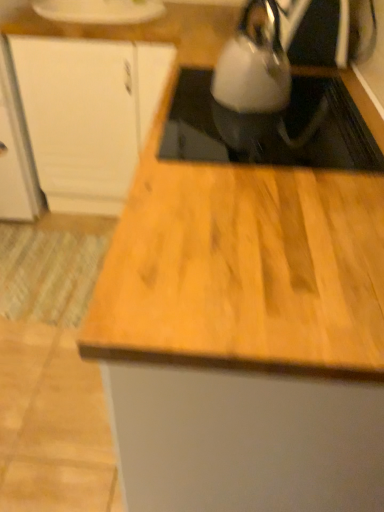
Describe the element at coordinates (88, 115) in the screenshot. The height and width of the screenshot is (512, 384). I see `white matte cabinet at upper left` at that location.

Where is `white matte cabinet at upper left`? The image size is (384, 512). white matte cabinet at upper left is located at coordinates (88, 115).

Identify the location of satin silver kettle at upper right. (253, 68).

Is satin silver kettle at upper right placed right next to white matte cabinet at upper left?

There is a gap between satin silver kettle at upper right and white matte cabinet at upper left.

Is satin silver kettle at upper right further to the viewer compared to white matte cabinet at upper left?

No.

Is white matte cabinet at upper left wider than white glossy kettle at upper center?

Yes, white matte cabinet at upper left is wider than white glossy kettle at upper center.

Consider the image. From the image's perspective, relative to white glossy kettle at upper center, is white matte cabinet at upper left above or below?

From the image's perspective, white matte cabinet at upper left appears above white glossy kettle at upper center.

From a real-world perspective, is white matte cabinet at upper left physically located above or below white glossy kettle at upper center?

white matte cabinet at upper left is situated lower than white glossy kettle at upper center in the real world.

Is white matte cabinet at upper left positioned with its back to white glossy kettle at upper center?

No.

Based on the photo, is white glossy kettle at upper center spatially inside white matte cabinet at upper left, or outside of it?

white glossy kettle at upper center cannot be found inside white matte cabinet at upper left.

Considering the sizes of white glossy kettle at upper center and white matte cabinet at upper left in the image, is white glossy kettle at upper center wider or thinner than white matte cabinet at upper left?

In the image, white glossy kettle at upper center appears to be more narrow than white matte cabinet at upper left.

How far apart are white glossy kettle at upper center and white matte cabinet at upper left?

33.94 inches.

Between white glossy kettle at upper center and white matte cabinet at upper left, which one has more height?

white matte cabinet at upper left is taller.

Can you confirm if satin silver kettle at upper right is shorter than white glossy kettle at upper center?

Incorrect, the height of satin silver kettle at upper right does not fall short of that of white glossy kettle at upper center.

Considering the sizes of objects satin silver kettle at upper right and white glossy kettle at upper center in the image provided, who is thinner, satin silver kettle at upper right or white glossy kettle at upper center?

Thinner between the two is satin silver kettle at upper right.

Where is `sink that is in front of the satin silver kettle at upper right`? The height and width of the screenshot is (512, 384). sink that is in front of the satin silver kettle at upper right is located at coordinates (274, 132).

Is white glossy kettle at upper center oriented away from satin silver kettle at upper right?

No, white glossy kettle at upper center is not facing the opposite direction of satin silver kettle at upper right.

Is satin silver kettle at upper right inside white glossy kettle at upper center?

Definitely not — satin silver kettle at upper right is not inside white glossy kettle at upper center.

In terms of height, does white glossy kettle at upper center look taller or shorter compared to satin silver kettle at upper right?

white glossy kettle at upper center is shorter than satin silver kettle at upper right.

In the scene shown: Does white matte cabinet at upper left have a lesser height compared to satin silver kettle at upper right?

Incorrect, the height of white matte cabinet at upper left does not fall short of that of satin silver kettle at upper right.

Is white matte cabinet at upper left outside of satin silver kettle at upper right?

Yes, white matte cabinet at upper left is located beyond the bounds of satin silver kettle at upper right.

Would you consider white matte cabinet at upper left to be distant from satin silver kettle at upper right?

No.

Is point (117, 192) closer or farther from the camera than point (227, 71)?

Point (117, 192) is positioned farther from the camera compared to point (227, 71).

The image size is (384, 512). I want to click on kettle below the white matte cabinet at upper left (from the image's perspective), so click(x=253, y=68).

Where is `cabinetry below the white glossy kettle at upper center (from a real-world perspective)`? This screenshot has height=512, width=384. cabinetry below the white glossy kettle at upper center (from a real-world perspective) is located at coordinates (88, 115).

From the image, which object appears to be farther from satin silver kettle at upper right, white glossy kettle at upper center or white matte cabinet at upper left?

Among the two, white matte cabinet at upper left is located further to satin silver kettle at upper right.

Estimate the real-world distances between objects in this image. Which object is further from satin silver kettle at upper right, white matte cabinet at upper left or white glossy kettle at upper center?

white matte cabinet at upper left.

Looking at the image, which one is located closer to white glossy kettle at upper center, satin silver kettle at upper right or white matte cabinet at upper left?

satin silver kettle at upper right is closer to white glossy kettle at upper center.

From the picture: From the image, which object appears to be farther from white matte cabinet at upper left, satin silver kettle at upper right or white glossy kettle at upper center?

white glossy kettle at upper center.

Based on their spatial positions, is white matte cabinet at upper left or satin silver kettle at upper right closer to white glossy kettle at upper center?

The object closer to white glossy kettle at upper center is satin silver kettle at upper right.

Based on their spatial positions, is white glossy kettle at upper center or satin silver kettle at upper right closer to white matte cabinet at upper left?

satin silver kettle at upper right is closer to white matte cabinet at upper left.

This screenshot has height=512, width=384. Find the location of `kettle between white glossy kettle at upper center and white matte cabinet at upper left in the front-back direction`. kettle between white glossy kettle at upper center and white matte cabinet at upper left in the front-back direction is located at coordinates (253, 68).